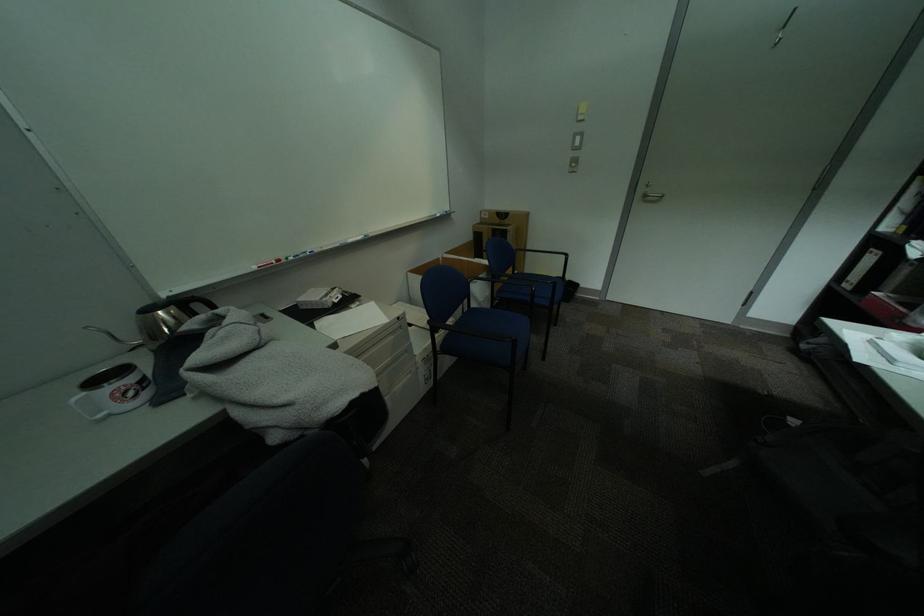
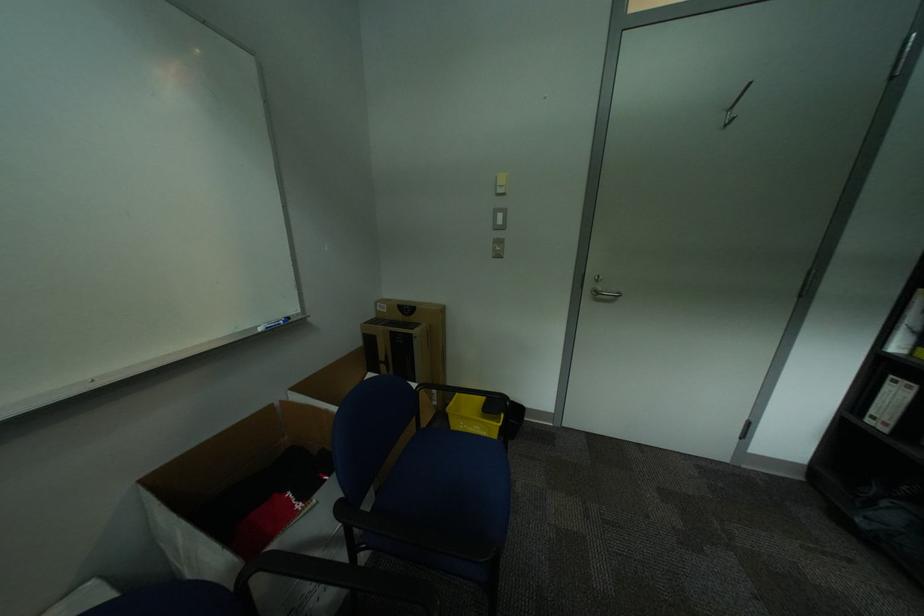
In the second image, find the point that corresponds to (655,197) in the first image.

(606, 294)